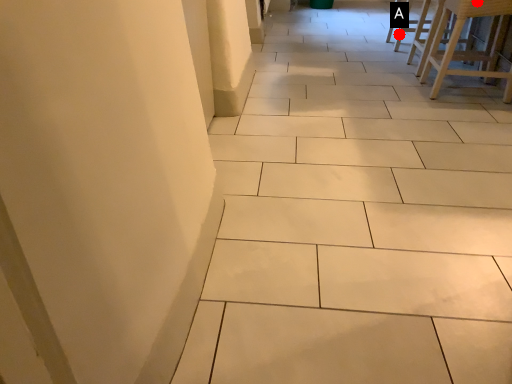
Question: Two points are circled on the image, labeled by A and B beside each circle. Which point is closer to the camera?

Choices:
 (A) A is closer
 (B) B is closer

Answer: (B)